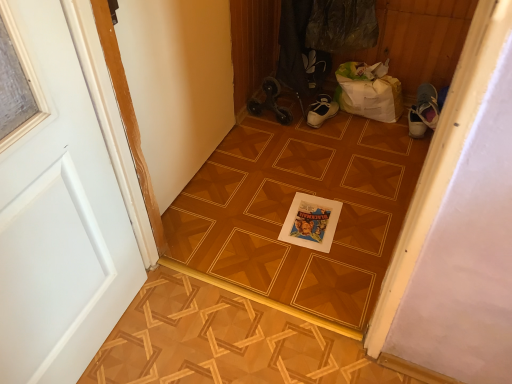
Find the location of a particular element. wooden parquet floor at center is located at coordinates point(228,343).

In order to face wooden parquet floor at center, should I rotate leftwards or rightwards?

Rotate your view right by about 6.832°.

Identify the location of white painted wood door at left. (60, 220).

Is wooden parquet floor at center next to wooden parquet floor at center?

No, wooden parquet floor at center is not beside wooden parquet floor at center.

Is wooden parquet floor at center to the left of wooden parquet floor at center from the viewer's perspective?

No, wooden parquet floor at center is not to the left of wooden parquet floor at center.

This screenshot has width=512, height=384. I want to click on tile below the wooden parquet floor at center (from a real-world perspective), so click(228, 343).

Is white painted wood door at left completely or partially inside wooden parquet floor at center?

No, white painted wood door at left is not surrounded by wooden parquet floor at center.

Which point is more forward, [230,333] or [5,188]?

The point [5,188] is closer to the camera.

Which of these two, wooden parquet floor at center or white painted wood door at left, is bigger?

white painted wood door at left is bigger.

Are wooden parquet floor at center and white painted wood door at left making contact?

wooden parquet floor at center is not next to white painted wood door at left, and they're not touching.

Is wooden parquet floor at center at the back of white painted wood door at left?

No, white painted wood door at left is not facing the opposite direction of wooden parquet floor at center.

Which is correct: white painted wood door at left is inside wooden parquet floor at center, or outside of it?

white painted wood door at left cannot be found inside wooden parquet floor at center.

From a real-world perspective, which is physically below, white painted wood door at left or wooden parquet floor at center?

wooden parquet floor at center, from a real-world perspective.

In the scene shown: How far apart are white painted wood door at left and wooden parquet floor at center?

white painted wood door at left and wooden parquet floor at center are 27.80 inches apart.

From a real-world perspective, which is physically above, white painted wood door at left or wooden parquet floor at center?

From a 3D spatial view, white painted wood door at left is above.

Is white painted wood door at left not within wooden parquet floor at center?

Absolutely, white painted wood door at left is external to wooden parquet floor at center.

Is white painted wood door at left next to wooden parquet floor at center and touching it?

white painted wood door at left is not next to wooden parquet floor at center, and they're not touching.

Could you tell me if white painted wood door at left is turned towards wooden parquet floor at center?

Yes, white painted wood door at left is turned towards wooden parquet floor at center.

Is point (179, 281) closer or farther from the camera than point (316, 314)?

Point (179, 281) is farther from the camera than point (316, 314).

From a real-world perspective, which is physically above, wooden parquet floor at center or wooden parquet floor at center?

wooden parquet floor at center.

Is wooden parquet floor at center not within wooden parquet floor at center?

Yes, wooden parquet floor at center is located beyond the bounds of wooden parquet floor at center.

Is wooden parquet floor at center positioned behind wooden parquet floor at center?

No, it is not.

Is wooden parquet floor at center not inside white painted wood door at left?

Yes.

Between point (369, 317) and point (70, 71), which one is positioned in front?

The point (70, 71) is closer to the camera.

From the image's perspective, is wooden parquet floor at center located above or below white painted wood door at left?

wooden parquet floor at center is situated higher than white painted wood door at left in the image.

Between wooden parquet floor at center and white painted wood door at left, which one appears on the left side from the viewer's perspective?

Positioned to the left is white painted wood door at left.

Identify the location of tile to the left of wooden parquet floor at center. The width and height of the screenshot is (512, 384). (228, 343).

Identify the location of tile that is on the right side of white painted wood door at left. (228, 343).

Which object lies nearer to the anchor point white painted wood door at left, wooden parquet floor at center or wooden parquet floor at center?

Among the two, wooden parquet floor at center is located nearer to white painted wood door at left.

Considering their positions, is wooden parquet floor at center positioned closer to wooden parquet floor at center than white painted wood door at left?

wooden parquet floor at center is closer to wooden parquet floor at center.

Estimate the real-world distances between objects in this image. Which object is closer to wooden parquet floor at center, wooden parquet floor at center or white painted wood door at left?

wooden parquet floor at center.

Based on their spatial positions, is white painted wood door at left or wooden parquet floor at center further from wooden parquet floor at center?

Based on the image, white painted wood door at left appears to be further to wooden parquet floor at center.

Which object lies nearer to the anchor point white painted wood door at left, wooden parquet floor at center or wooden parquet floor at center?

The object closer to white painted wood door at left is wooden parquet floor at center.

Based on their spatial positions, is white painted wood door at left or wooden parquet floor at center further from wooden parquet floor at center?

white painted wood door at left is further to wooden parquet floor at center.

The image size is (512, 384). I want to click on tile between white painted wood door at left and wooden parquet floor at center along the z-axis, so click(228, 343).